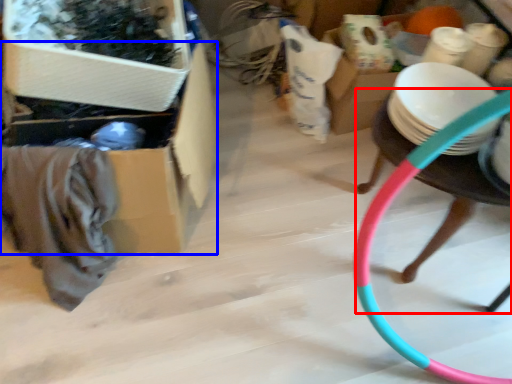
Question: Which of the following is the farthest to the observer, chair (highlighted by a red box) or storage box (highlighted by a blue box)?

Choices:
 (A) chair
 (B) storage box

Answer: (B)